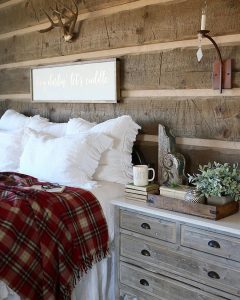
Find the location of a particular element. The height and width of the screenshot is (300, 240). planter porcelain white is located at coordinates point(222,196).